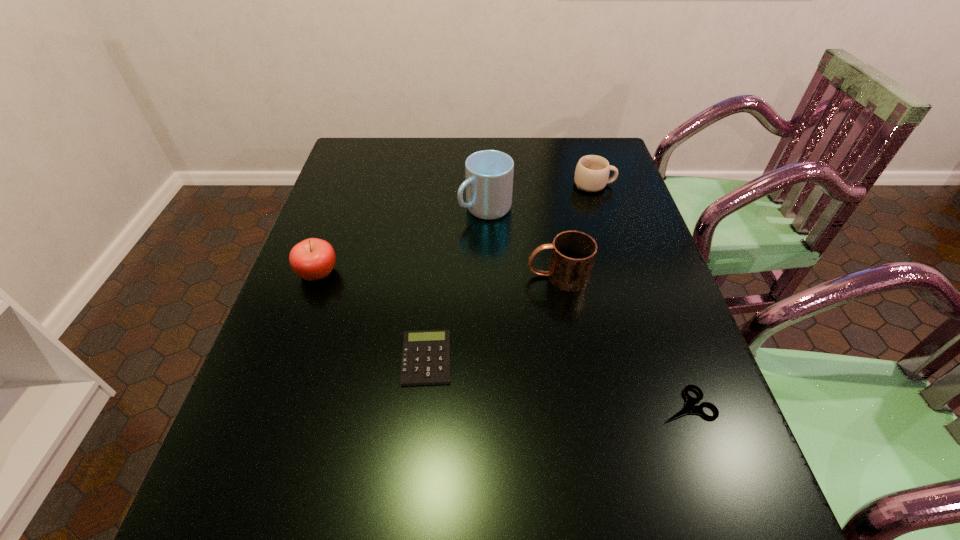
Image resolution: width=960 pixels, height=540 pixels. I want to click on the tallest mug, so click(489, 173).

Identify the location of the leftmost mug. The height and width of the screenshot is (540, 960). (489, 173).

The height and width of the screenshot is (540, 960). Identify the location of the second mug from left to right. (573, 253).

In order to click on the fourth object from left to right in this screenshot , I will do `click(573, 253)`.

Identify the location of apple. Image resolution: width=960 pixels, height=540 pixels. (312, 259).

Where is `the fourth tallest object`? This screenshot has width=960, height=540. the fourth tallest object is located at coordinates (592, 172).

The width and height of the screenshot is (960, 540). What are the coordinates of `the rightmost mug` in the screenshot? It's located at (592, 172).

Where is `the fifth farthest object`? This screenshot has height=540, width=960. the fifth farthest object is located at coordinates click(x=426, y=354).

At what (x,y) coordinates should I click in order to perform the action: click on calculator. Please return your answer as a coordinate pair (x, y). This screenshot has width=960, height=540. Looking at the image, I should click on (426, 354).

Identify the location of the nearest object. (690, 407).